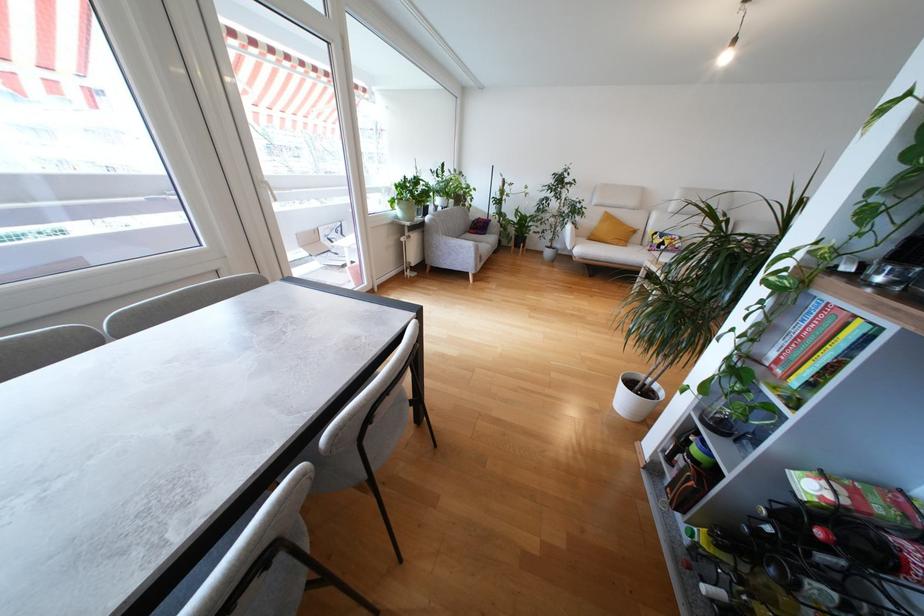
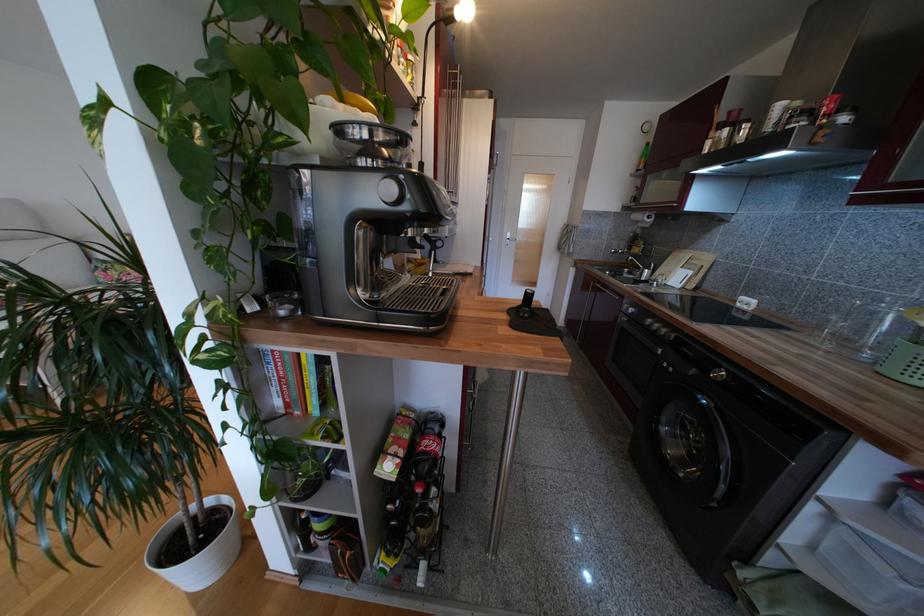
The first image is from the beginning of the video and the second image is from the end. How did the camera likely rotate when shooting the video?

The camera rotated toward right-down.